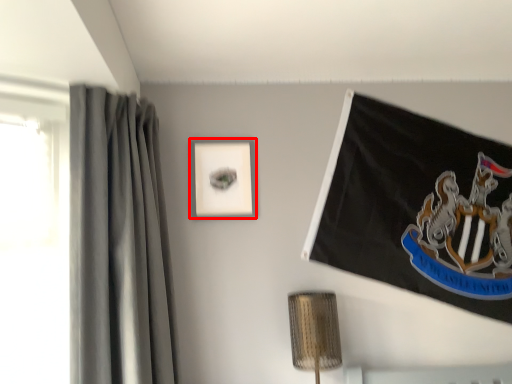
Question: In this image, where is picture frame (annotated by the red box) located relative to curtain?

Choices:
 (A) left
 (B) right

Answer: (B)